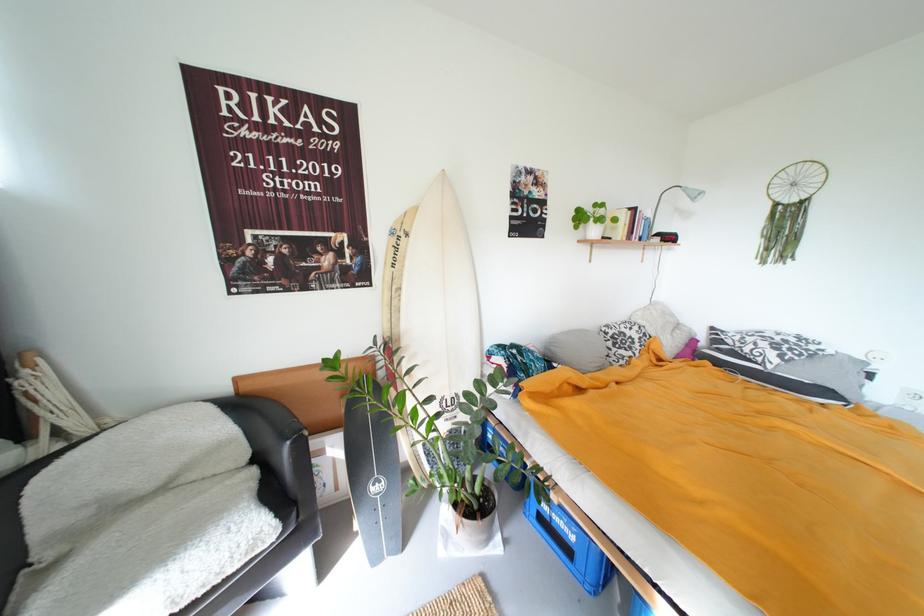
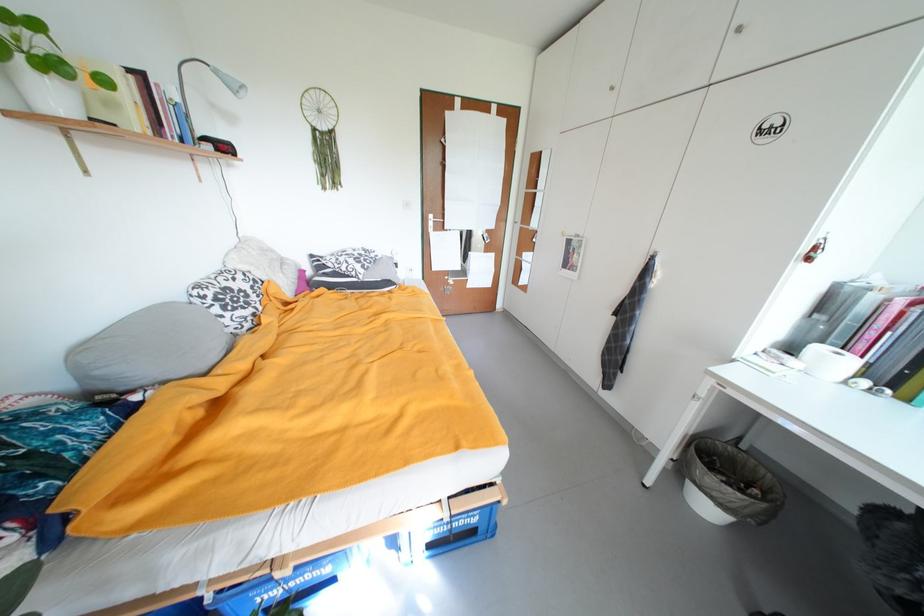
Locate, in the second image, the point that corresponds to (x=638, y=211) in the first image.

(138, 71)